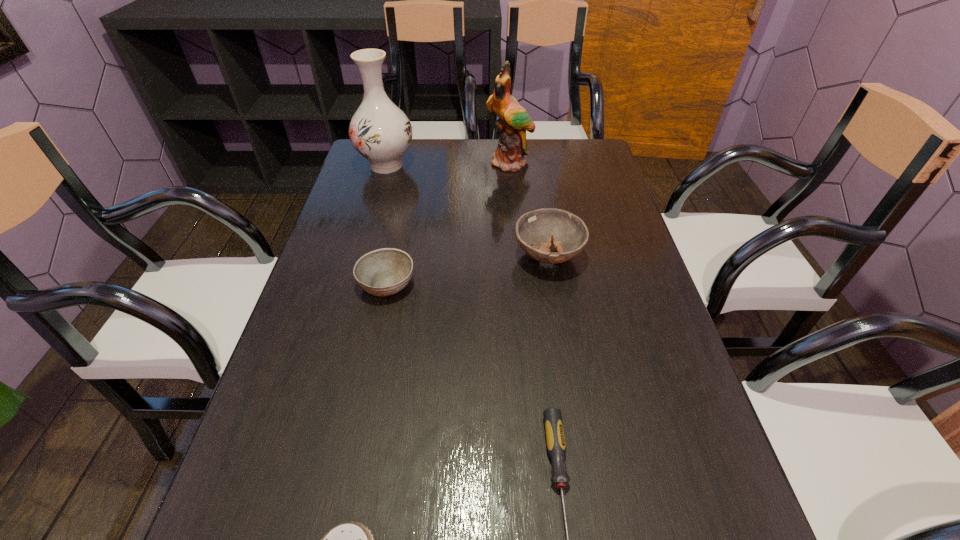
In the image, there is a desktop. Where is `vacant space at the far right corner`? vacant space at the far right corner is located at coordinates (569, 170).

Locate an element on the screen. The width and height of the screenshot is (960, 540). free space between the vase and the shorter bowl is located at coordinates (387, 224).

You are a GUI agent. You are given a task and a screenshot of the screen. Output one action in this format:
    pyautogui.click(x=<x>, y=<y>)
    Task: Click on the vacant point located between the vase and the parrot
    This screenshot has width=960, height=540.
    Given the screenshot: What is the action you would take?
    pyautogui.click(x=448, y=164)

What are the coordinates of `empty space between the shorter bowl and the taller bowl` in the screenshot? It's located at (468, 269).

You are a GUI agent. You are given a task and a screenshot of the screen. Output one action in this format:
    pyautogui.click(x=<x>, y=<y>)
    Task: Click on the free space between the parrot and the vase
    This screenshot has width=960, height=540.
    Given the screenshot: What is the action you would take?
    pyautogui.click(x=448, y=164)

This screenshot has height=540, width=960. What are the coordinates of `the closest object to the chocolate cake` in the screenshot? It's located at (555, 441).

You are a GUI agent. You are given a task and a screenshot of the screen. Output one action in this format:
    pyautogui.click(x=<x>, y=<y>)
    Task: Click on the object that is the closest to the taller bowl
    Image resolution: width=960 pixels, height=540 pixels.
    Given the screenshot: What is the action you would take?
    pyautogui.click(x=383, y=272)

Image resolution: width=960 pixels, height=540 pixels. What are the coordinates of `free location that satisfies the following two spatial constraints: 1. on the front-facing side of the taller bowl; 2. on the left side of the parrot` in the screenshot? It's located at (518, 256).